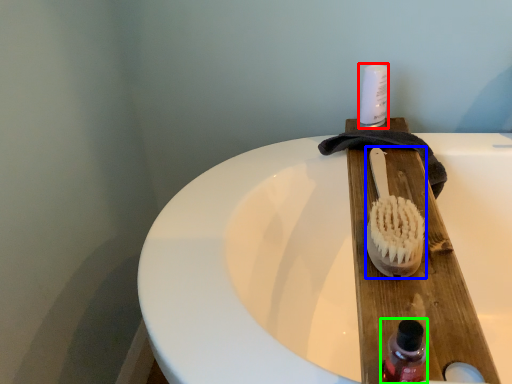
Question: Based on their relative distances, which object is farther from toiletry (highlighted by a red box)? Choose from brush (highlighted by a blue box) and bottle (highlighted by a green box).

Choices:
 (A) brush
 (B) bottle

Answer: (B)